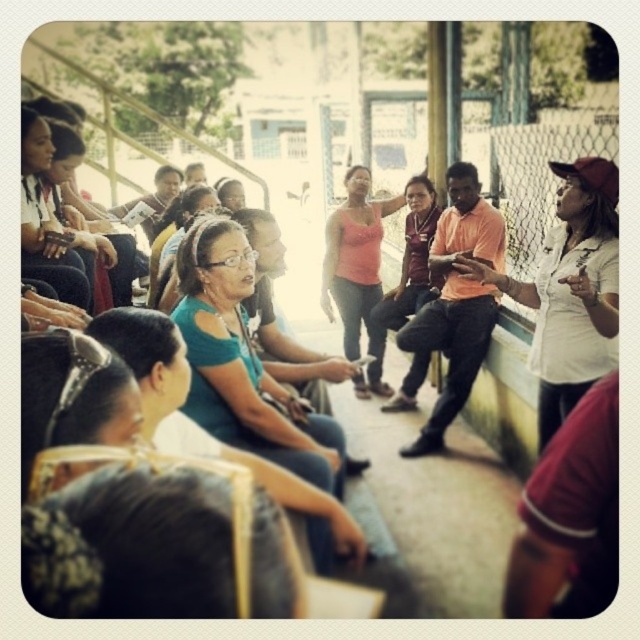
You are a GUI agent. You are given a task and a screenshot of the screen. Output one action in this format:
    pyautogui.click(x=<x>, y=<y>)
    Task: Click on the teal fabric shirt at center
    The width and height of the screenshot is (640, 640).
    Given the screenshot: What is the action you would take?
    pyautogui.click(x=205, y=432)

Which is more to the right, teal fabric shirt at center or matte pink shirt at center?

matte pink shirt at center

Is point (168, 429) positioned before point (428, 300)?

Yes, point (168, 429) is closer to viewer.

Locate an element on the screen. The height and width of the screenshot is (640, 640). teal fabric shirt at center is located at coordinates (205, 432).

Is point (602, 243) less distant than point (392, 323)?

Yes, it is in front of point (392, 323).

Is white matte shirt at right above matte pink shirt at center?

No, white matte shirt at right is not above matte pink shirt at center.

Locate an element on the screen. Image resolution: width=640 pixels, height=640 pixels. white matte shirt at right is located at coordinates (570, 291).

From the picture: Can you confirm if matte pink shirt at center is bigger than matte black laptop at left?

Yes, matte pink shirt at center is bigger than matte black laptop at left.

Is point (401, 388) farther from viewer compared to point (24, 125)?

That is True.

Locate an element on the screen. This screenshot has height=640, width=640. matte pink shirt at center is located at coordinates coord(412,259).

You are a GUI agent. You are given a task and a screenshot of the screen. Output one action in this format:
    pyautogui.click(x=<x>, y=<y>)
    Task: Click on the matte pink shirt at center
    The image size is (640, 640).
    Given the screenshot: What is the action you would take?
    pyautogui.click(x=412, y=259)